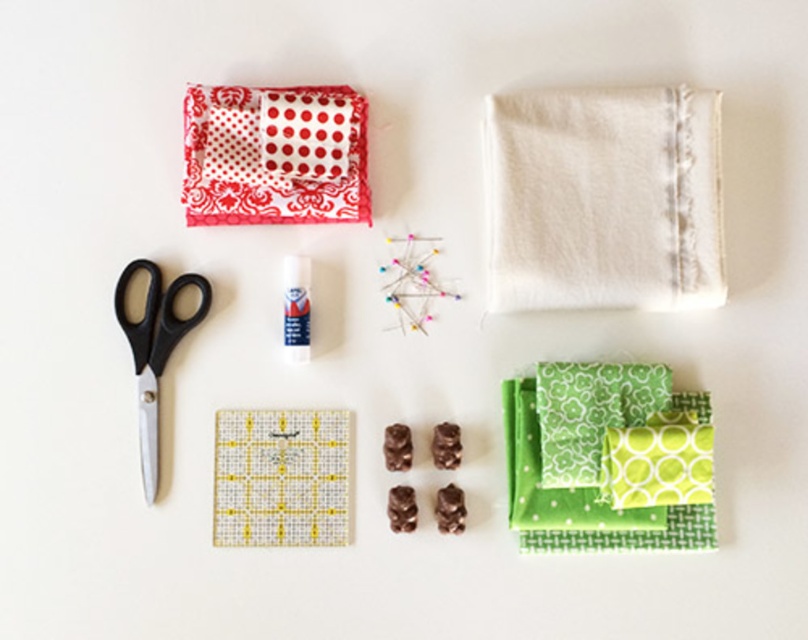
The image size is (808, 640). What do you see at coordinates (604, 198) in the screenshot?
I see `white cotton cloth at upper right` at bounding box center [604, 198].

Consider the image. Does white cotton cloth at upper right appear over red polka dot fabric at upper left?

Incorrect, white cotton cloth at upper right is not positioned above red polka dot fabric at upper left.

Does point (720, 244) come closer to viewer compared to point (365, 212)?

Yes, point (720, 244) is in front of point (365, 212).

Where is `white cotton cloth at upper right`? The height and width of the screenshot is (640, 808). white cotton cloth at upper right is located at coordinates (604, 198).

Is white cotton cloth at upper right above black plastic scissors at left?

Yes.

From the picture: Measure the distance between point (575, 289) and camera.

1.19 meters

Find the location of a particular element. white cotton cloth at upper right is located at coordinates (604, 198).

Can you confirm if white cotton cloth at upper right is positioned to the right of green fabric at center right?

Yes, white cotton cloth at upper right is to the right of green fabric at center right.

Between white cotton cloth at upper right and green fabric at center right, which one appears on the left side from the viewer's perspective?

green fabric at center right

Is point (701, 129) farther from camera compared to point (554, 417)?

No, (701, 129) is closer to viewer.

At what (x,y) coordinates should I click in order to perform the action: click on white cotton cloth at upper right. Please return your answer as a coordinate pair (x, y). Image resolution: width=808 pixels, height=640 pixels. Looking at the image, I should click on (604, 198).